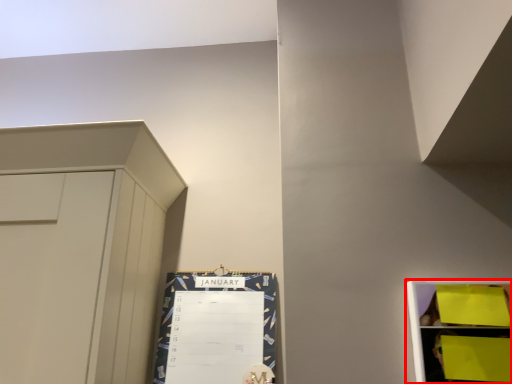
Question: From the image's perspective, what is the correct spatial relationship of shelf (annotated by the red box) in relation to bulletin board?

Choices:
 (A) above
 (B) below

Answer: (A)